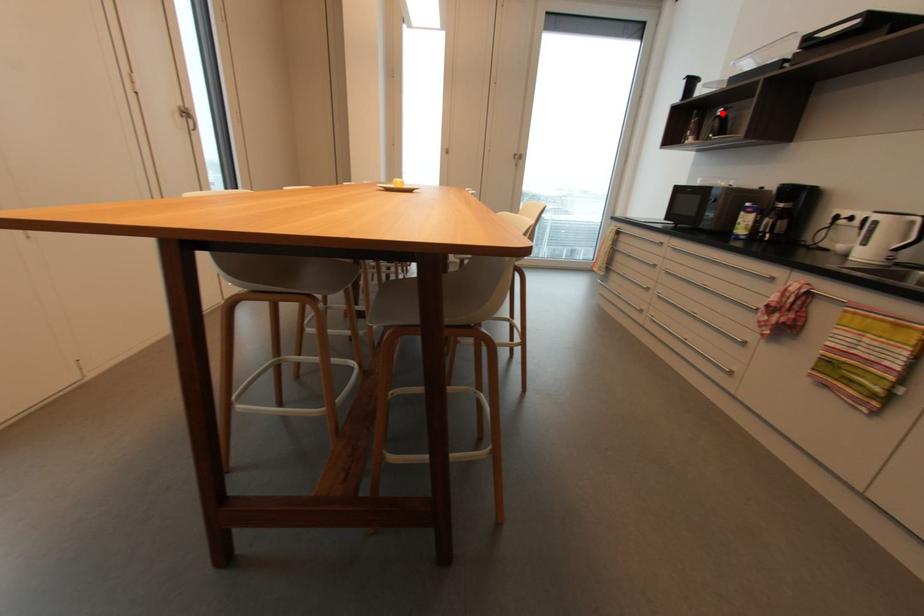
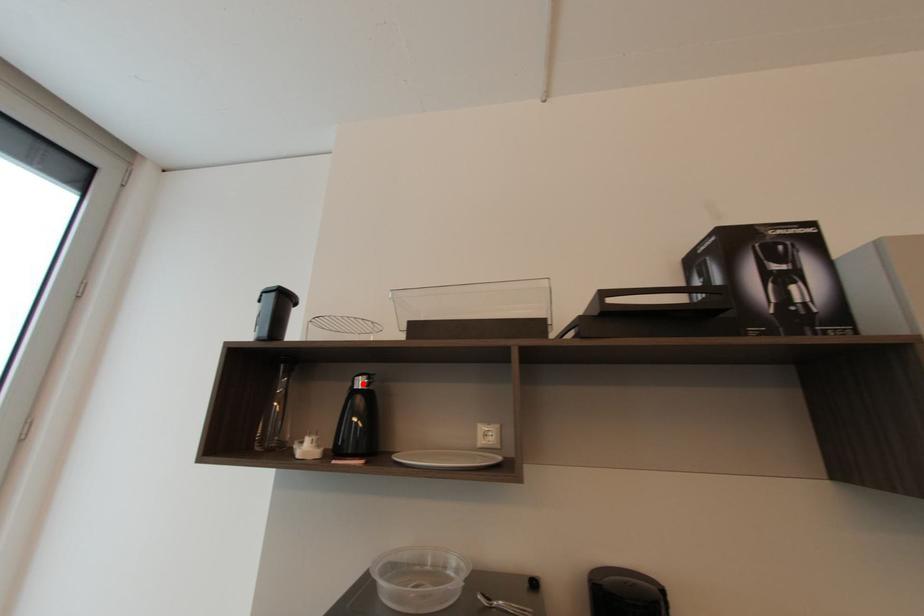
Looking at this image, I am providing you with two images of the same scene from different viewpoints. A red point is marked on the first image and another point is marked on the second image. Is the red point in image1 aligned with the point shown in image2?

Yes